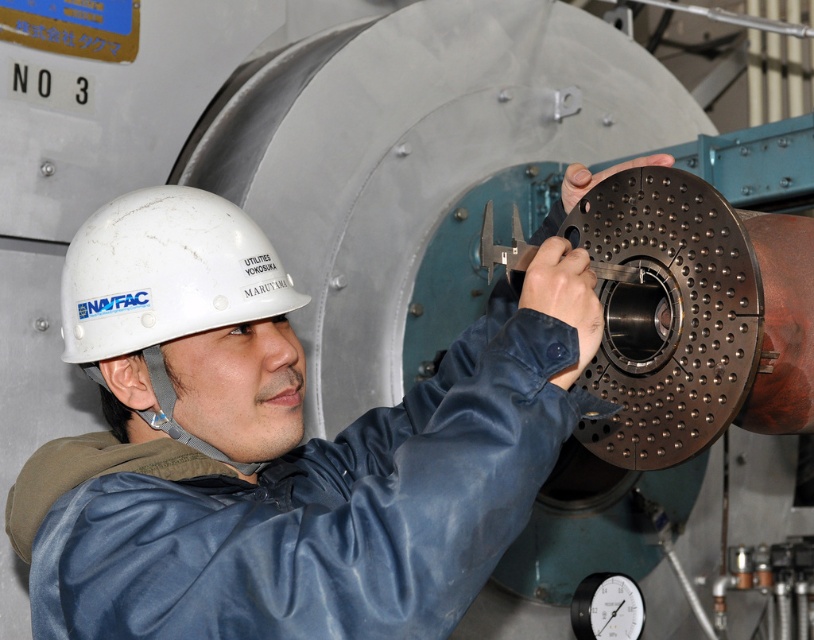
Is white matte hard hat at upper center positioned before white matte hard hat at center?

Yes, white matte hard hat at upper center is in front of white matte hard hat at center.

Is point (134, 380) less distant than point (193, 438)?

No, it is not.

What are the coordinates of `white matte hard hat at upper center` in the screenshot? It's located at point(311,481).